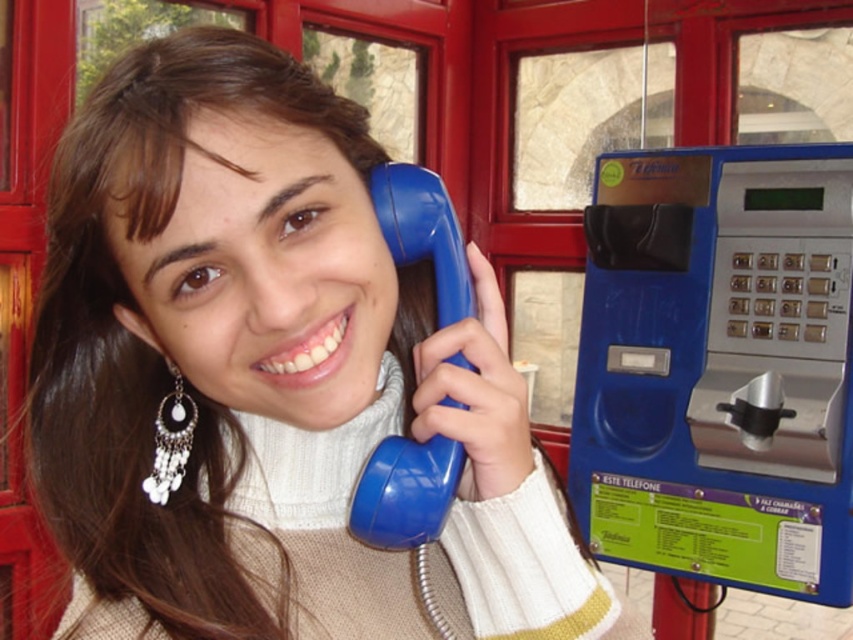
Question: Which is farther from the matte blue phone at center?

Choices:
 (A) blue plastic phone box at right
 (B) silver/glass earrings at lower left

Answer: (A)

Question: Is matte blue phone at center to the left of blue plastic phone box at right from the viewer's perspective?

Choices:
 (A) yes
 (B) no

Answer: (A)

Question: Which point is farther from the camera taking this photo?

Choices:
 (A) (787, 381)
 (B) (158, 476)

Answer: (A)

Question: Which object appears closest to the camera in this image?

Choices:
 (A) silver/glass earrings at lower left
 (B) blue plastic phone box at right

Answer: (A)

Question: Is matte blue phone at center closer to camera compared to blue plastic phone box at right?

Choices:
 (A) yes
 (B) no

Answer: (A)

Question: Is matte blue phone at center above blue plastic phone box at right?

Choices:
 (A) no
 (B) yes

Answer: (A)